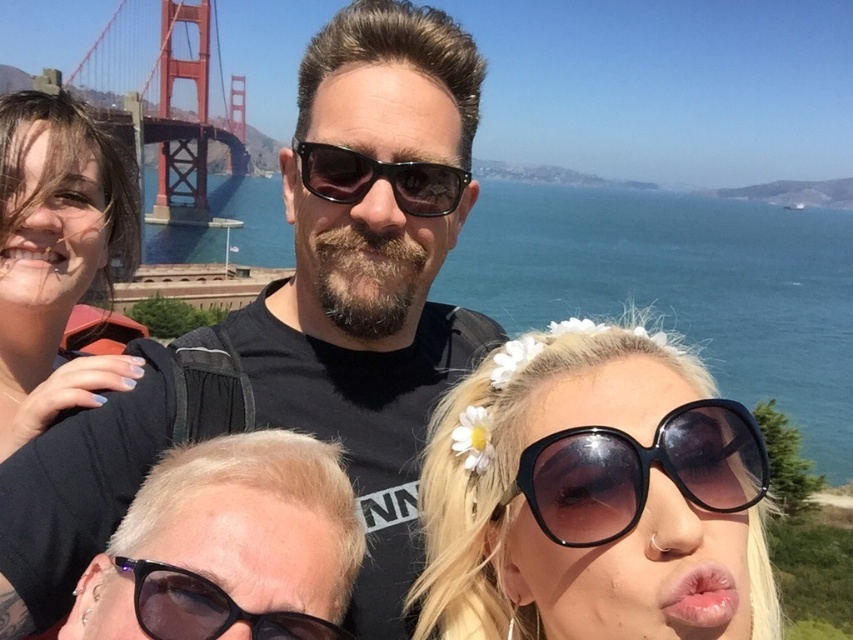
Question: Can you confirm if blonde hair at center is wider than black reflective sunglasses at lower left?

Choices:
 (A) yes
 (B) no

Answer: (A)

Question: Is blonde hair with flowers at lower right to the left of black reflective sunglasses at lower left from the viewer's perspective?

Choices:
 (A) no
 (B) yes

Answer: (A)

Question: Does black plastic sunglasses at lower right appear under black plastic sunglasses at center?

Choices:
 (A) no
 (B) yes

Answer: (B)

Question: Considering the real-world distances, which object is farthest from the black reflective sunglasses at lower left?

Choices:
 (A) black plastic sunglasses at lower right
 (B) black plastic sunglasses at center
 (C) blonde hair with flowers at lower right

Answer: (B)

Question: Which of these objects is positioned closest to the black matte sunglasses at center?

Choices:
 (A) red painted steel golden gate bridge at upper left
 (B) black plastic sunglasses at lower right
 (C) blonde hair with flowers at lower right

Answer: (C)

Question: Which object is closer to the camera taking this photo?

Choices:
 (A) matte black hair at left
 (B) black plastic sunglasses at center
 (C) black reflective sunglasses at lower left
 (D) blonde hair at center

Answer: (D)